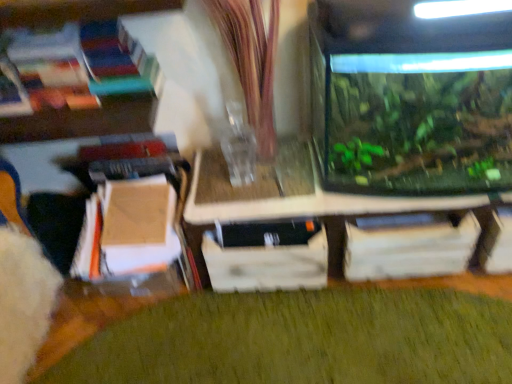
Question: Based on their sizes in the image, would you say wooden drawer at center is bigger or smaller than green matte plant at lower center?

Choices:
 (A) small
 (B) big

Answer: (A)

Question: In the image, is wooden drawer at center on the left side or the right side of green matte plant at lower center?

Choices:
 (A) right
 (B) left

Answer: (B)

Question: Which object is the farthest from the green matte plant at lower center?

Choices:
 (A) transparent glass tank at right
 (B) wooden drawer at center
 (C) transparent glass tank at center

Answer: (A)

Question: Which of these objects is positioned closest to the transparent glass tank at center?

Choices:
 (A) transparent glass tank at right
 (B) wooden drawer at center
 (C) green matte plant at lower center

Answer: (B)